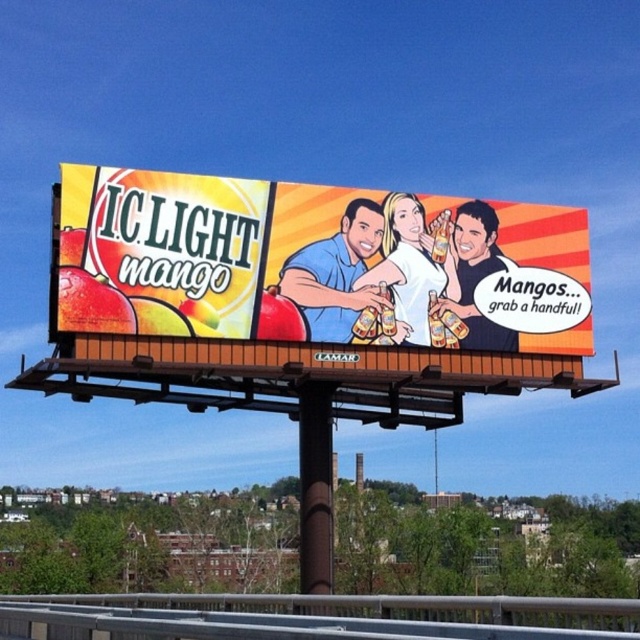
You are a painter standing at the base of the matte yellow billboard at center. You want to paint the top of the billboard but you can only reach up to the height of the smooth skin man at center. Will you be able to paint the entire billboard?

The matte yellow billboard at center is much taller than the smooth skin man at center, so you won not be able to paint the entire billboard since it extends beyond your reach.

You are standing in front of the billboard and want to take a photo of the point at coordinates point (426,305). If your camera has a maximum focus range of 25 meters, will it be able to focus on that point?

The distance of point (426,305) from camera is 23.47 meters, so yes, the camera can focus on that point since it is within the maximum focus range of 25 meters.

You are a painter standing in front of the image. You need to paint a copy of the billboard but want to ensure the smooth skin tone at center is proportionate to the matte yellow billboard at center. According to the scene, what should you do?

The matte yellow billboard at center is larger in size than the smooth skin tone at center, so you should paint the smooth skin tone at center smaller than the matte yellow billboard at center to maintain proportion.